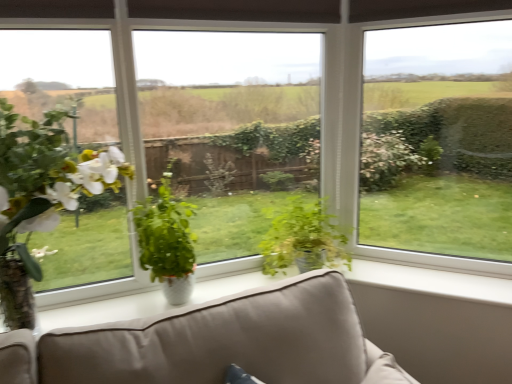
Question: From a real-world perspective, is green glossy plant at center, which is counted as the 2th houseplant, starting from the right, positioned above or below green matte plant at left, which is counted as the 3th houseplant, starting from the right?

Choices:
 (A) below
 (B) above

Answer: (A)

Question: Is green glossy plant at center, which is counted as the 2th houseplant, starting from the right, situated inside green matte plant at left, which is the first houseplant from left to right, or outside?

Choices:
 (A) outside
 (B) inside

Answer: (A)

Question: Which is nearer to the transparent glass window at center?

Choices:
 (A) green matte plant at left, which is counted as the 3th houseplant, starting from the right
 (B) green glossy plant at center, which is counted as the 2th houseplant, starting from the right
 (C) green glossy plant at center, which ranks as the first houseplant in right-to-left order
 (D) transparent glass window at center

Answer: (C)

Question: Which object is the closest to the green glossy plant at center, the 2th houseplant viewed from the left?

Choices:
 (A) green glossy plant at center, the 3th houseplant when ordered from left to right
 (B) transparent glass window at center
 (C) green matte plant at left, which is the first houseplant from left to right
 (D) transparent glass window at center

Answer: (B)